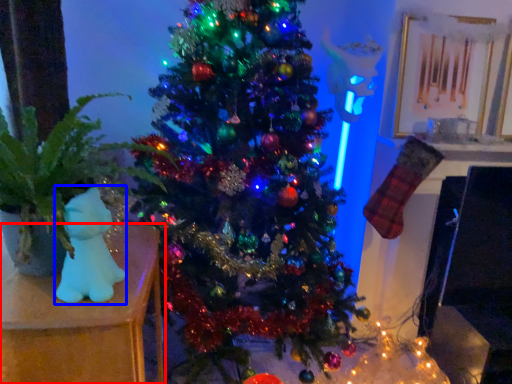
Question: Which object is closer to the camera taking this photo, furniture (highlighted by a red box) or toy (highlighted by a blue box)?

Choices:
 (A) furniture
 (B) toy

Answer: (A)